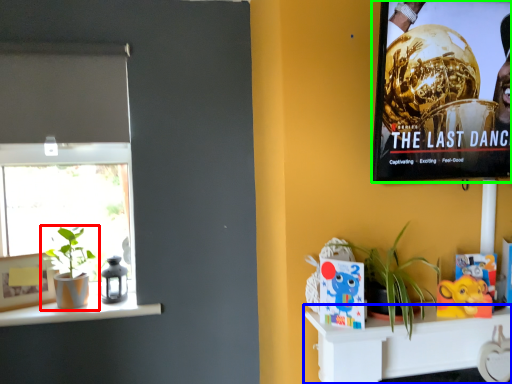
Question: Considering the real-world distances, which object is farthest from houseplant (highlighted by a red box)? shelf (highlighted by a blue box) or movie poster (highlighted by a green box)?

Choices:
 (A) shelf
 (B) movie poster

Answer: (B)